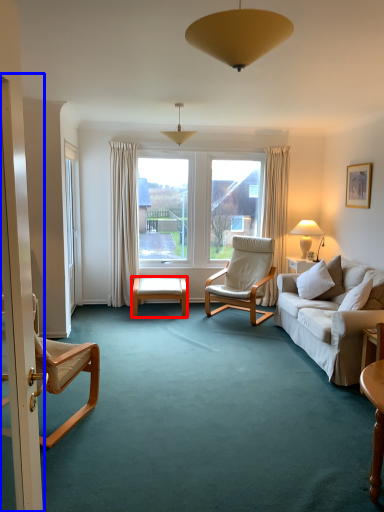
Question: Which of the following is the farthest to the observer, table (highlighted by a red box) or screen door (highlighted by a blue box)?

Choices:
 (A) table
 (B) screen door

Answer: (A)